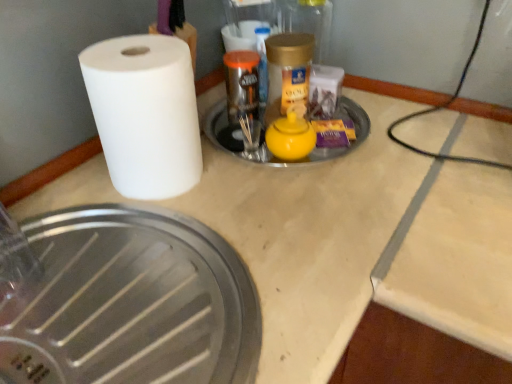
Where is `free space above brushed metal manhole cover at lower left, which is counted as the 1th manhole cover, starting from the bottom (from a real-world perspective)`? free space above brushed metal manhole cover at lower left, which is counted as the 1th manhole cover, starting from the bottom (from a real-world perspective) is located at coordinates (118, 285).